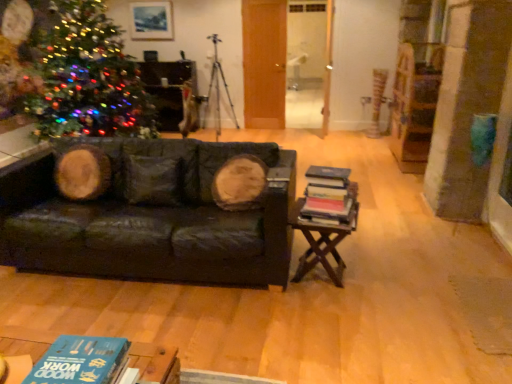
Question: From the image's perspective, relative to blue matte book at lower left, the 2th book from the top, is multicolored lights at left above or below?

Choices:
 (A) below
 (B) above

Answer: (B)

Question: From a real-world perspective, is multicolored lights at left physically located above or below blue matte book at lower left, placed as the 1th book when sorted from front to back?

Choices:
 (A) below
 (B) above

Answer: (B)

Question: Which is nearer to the metallic tripod at center?

Choices:
 (A) hardcover books at right, the 1th book positioned from the top
 (B) dark green leather couch at center
 (C) multicolored lights at left
 (D) wooden at right
 (E) matte wooden picture frame at upper center

Answer: (E)

Question: Which is farther from the matte wooden picture frame at upper center?

Choices:
 (A) hardcover books at right, the 1th book positioned from the top
 (B) multicolored lights at left
 (C) metallic tripod at center
 (D) dark green leather couch at center
 (E) blue matte book at lower left, which appears as the second book when viewed from the back

Answer: (E)